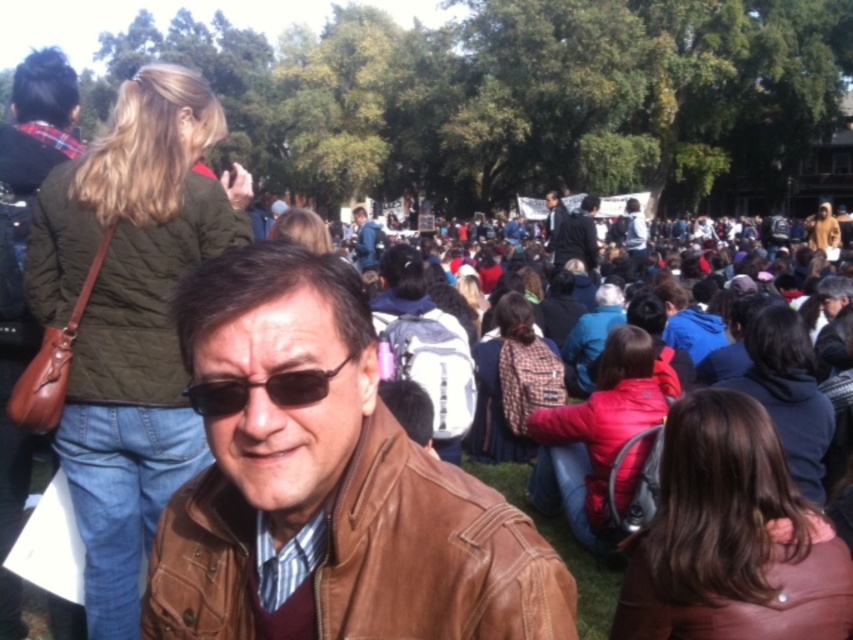
Is black leather goggles at center taller than dark blue leather jacket at center?

No, black leather goggles at center is not taller than dark blue leather jacket at center.

Does point (236, 401) lie behind point (548, 204)?

No.

Find the location of a particular element. black leather goggles at center is located at coordinates (264, 388).

Where is `black leather goggles at center`? This screenshot has width=853, height=640. black leather goggles at center is located at coordinates (264, 388).

Does brown leather jacket at center have a greater width compared to blue denim jacket at center?

Correct, the width of brown leather jacket at center exceeds that of blue denim jacket at center.

Measure the distance from brown leather jacket at center to blue denim jacket at center.

brown leather jacket at center and blue denim jacket at center are 52.76 meters apart.

Who is more forward, (477, 625) or (364, 266)?

Point (477, 625) is in front.

The height and width of the screenshot is (640, 853). Identify the location of brown leather jacket at center. (432, 552).

Is dark gray jacket at center above dark blue leather jacket at center?

No, dark gray jacket at center is not above dark blue leather jacket at center.

Between point (567, 234) and point (549, 193), which one is positioned behind?

Point (549, 193)

Locate an element on the screen. dark gray jacket at center is located at coordinates (578, 236).